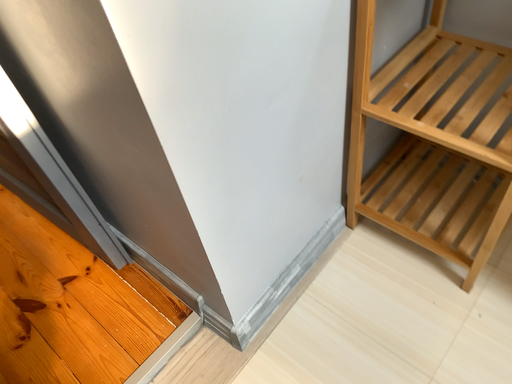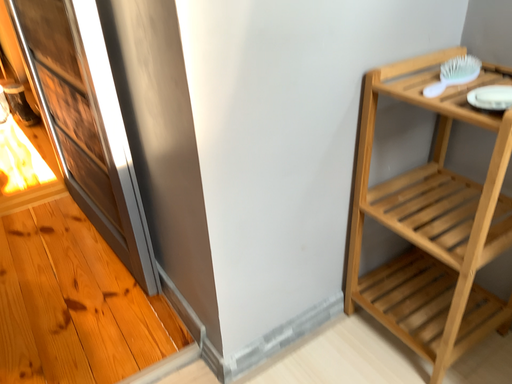
Question: Which way did the camera rotate in the video?

Choices:
 (A) rotated downward
 (B) rotated upward

Answer: (B)